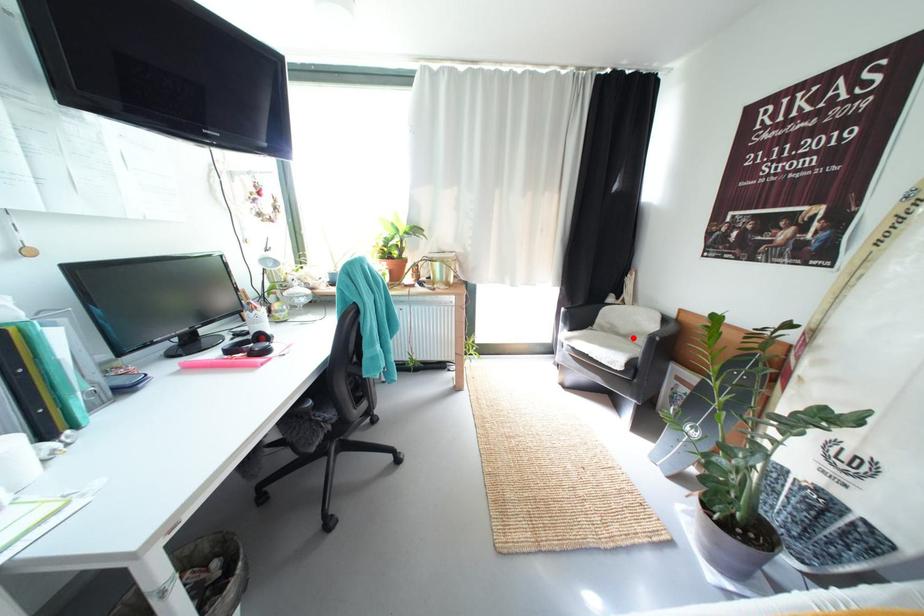
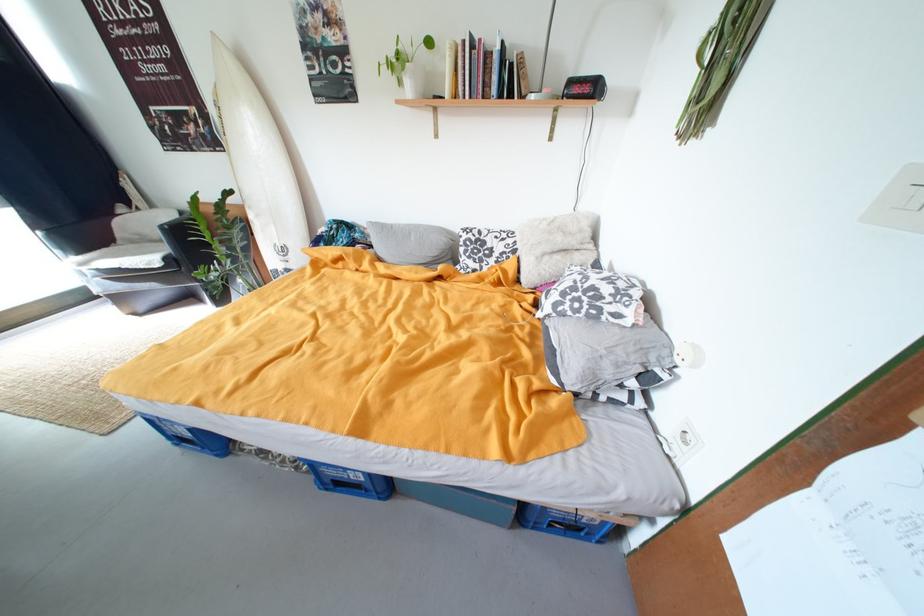
Question: A red point is marked in image1. In image2, is the corresponding 3D point closer to the camera or farther? Reply with the corresponding letter.

Choices:
 (A) The corresponding 3D point is closer.
 (B) The corresponding 3D point is farther.

Answer: (B)